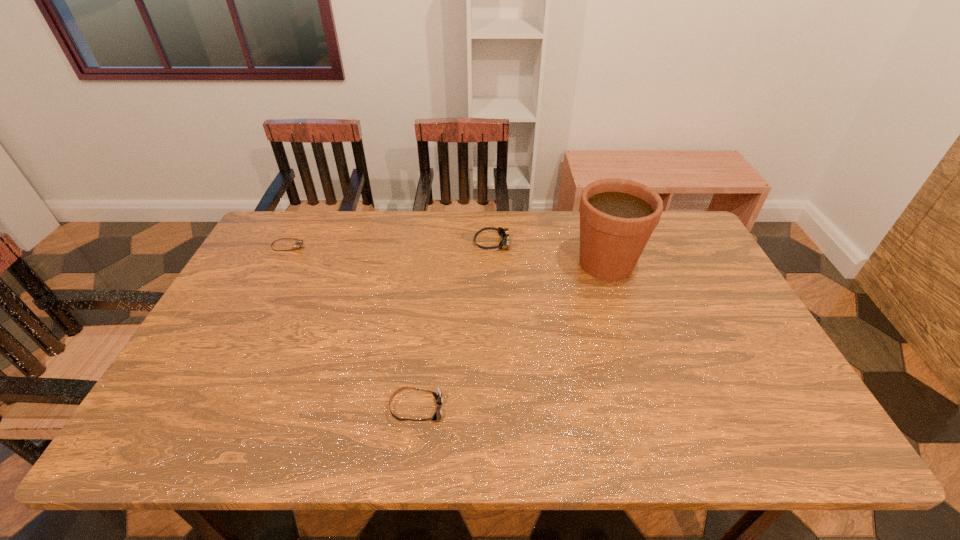
Find the location of a particular element. Image resolution: width=960 pixels, height=540 pixels. vacant space positioned through the lenses of the rightmost goggles is located at coordinates (393, 243).

Locate an element on the screen. blank area located through the lenses of the rightmost goggles is located at coordinates (357, 243).

Identify the location of vacant space located on the front-facing side of the second shortest object. The height and width of the screenshot is (540, 960). pyautogui.click(x=494, y=409).

Where is `vacant space situated 0.200m on the front lenses and sides of the leftmost goggles`? This screenshot has height=540, width=960. vacant space situated 0.200m on the front lenses and sides of the leftmost goggles is located at coordinates (367, 247).

You are a GUI agent. You are given a task and a screenshot of the screen. Output one action in this format:
    pyautogui.click(x=<x>, y=<y>)
    Task: Click on the flowerpot that is at the far edge
    The image size is (960, 540).
    Given the screenshot: What is the action you would take?
    pyautogui.click(x=617, y=216)

Find the location of a particular element. This screenshot has width=960, height=540. object at the near edge is located at coordinates (438, 395).

Locate an element on the screen. This screenshot has width=960, height=540. object positioned at the left edge is located at coordinates (299, 243).

Find the location of a particular element. The width and height of the screenshot is (960, 540). object located in the far left corner section of the desktop is located at coordinates pos(299,243).

In the image, there is a desktop. Identify the location of blank space at the far edge. (508, 252).

Identify the location of free spot at the near edge of the desktop. Image resolution: width=960 pixels, height=540 pixels. (218, 448).